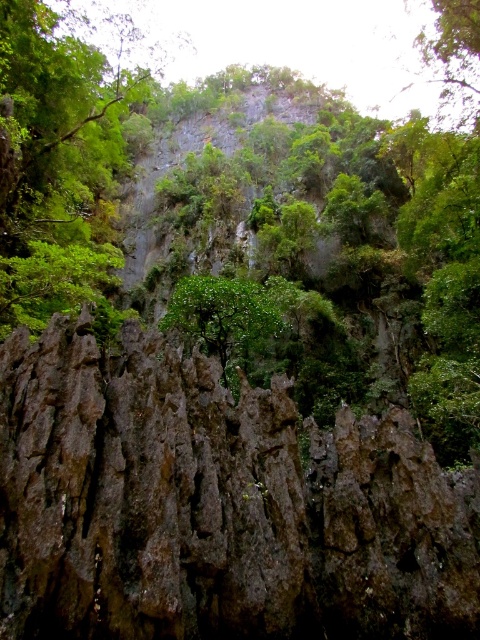
Between green leafy tree at upper center and green leafy tree at center, which one has more height?

With more height is green leafy tree at upper center.

Does green leafy tree at upper center appear on the right side of green leafy tree at center?

In fact, green leafy tree at upper center is to the left of green leafy tree at center.

Who is more distant from viewer, (45, 202) or (242, 326)?

The point (45, 202) is more distant.

At what (x,y) coordinates should I click in order to perform the action: click on green leafy tree at upper center. Please return your answer as a coordinate pair (x, y). The width and height of the screenshot is (480, 640). Looking at the image, I should click on (59, 161).

Can you confirm if dark brown rocky cliff at center is shorter than green leafy tree at upper center?

Yes.

Is dark brown rocky cliff at center to the left of green leafy tree at upper center from the viewer's perspective?

No, dark brown rocky cliff at center is not to the left of green leafy tree at upper center.

The width and height of the screenshot is (480, 640). In order to click on dark brown rocky cliff at center in this screenshot , I will do `click(216, 506)`.

Is point (243, 500) more distant than point (212, 332)?

No, it is in front of (212, 332).

Who is more distant from viewer, (19, 433) or (210, 305)?

The point (210, 305) is behind.

Locate an element on the screen. dark brown rocky cliff at center is located at coordinates (216, 506).